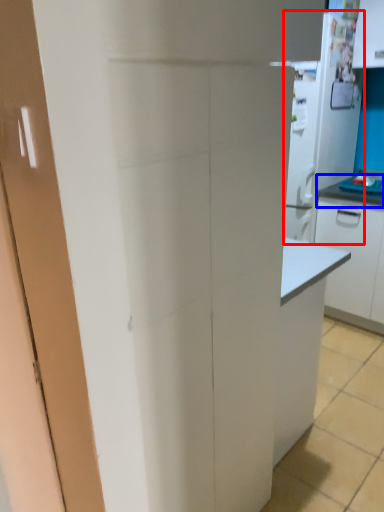
Question: Among these objects, which one is nearest to the camera, appliance (highlighted by a red box) or countertop (highlighted by a blue box)?

Choices:
 (A) appliance
 (B) countertop

Answer: (A)